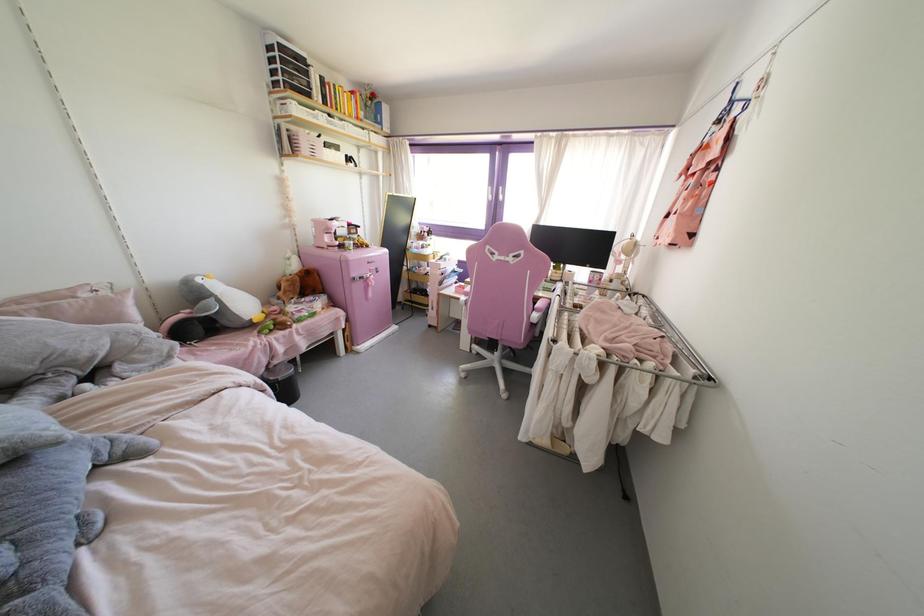
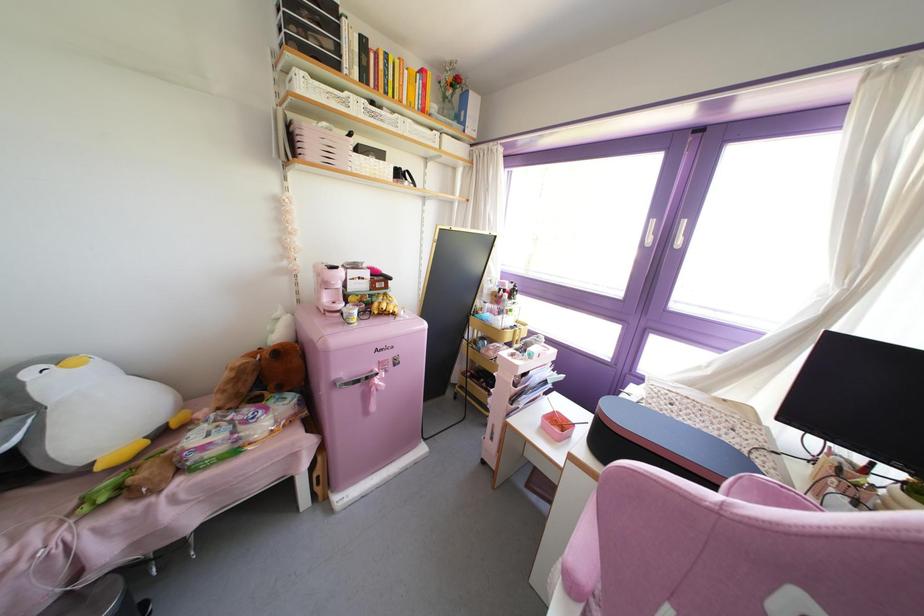
The point at [254,320] is marked in the first image. Where is the corresponding point in the second image?

(99, 467)